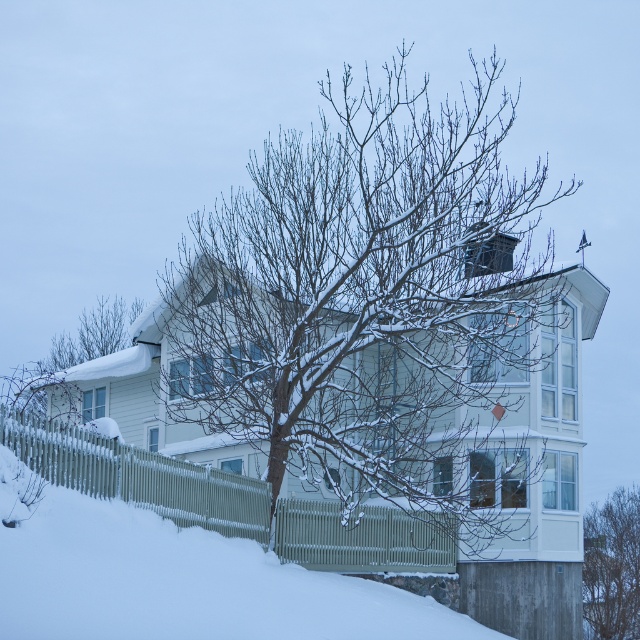
You are standing in front of the house and want to determine the relative positions of two points marked in the image. Which point, point 1 at coordinates (614, 580) or point 2 at coordinates (83, 333), is closer to you?

Point 1 at coordinates (614, 580) is closer to the viewer than point 2 at coordinates (83, 333).

You are standing in front of the snowy house and notice two points marked on the image. The first point is at coordinates point (180, 465) and the second is at point (636, 570). Which point is closer to you?

Point (180, 465) is closer to the viewer than point (636, 570).